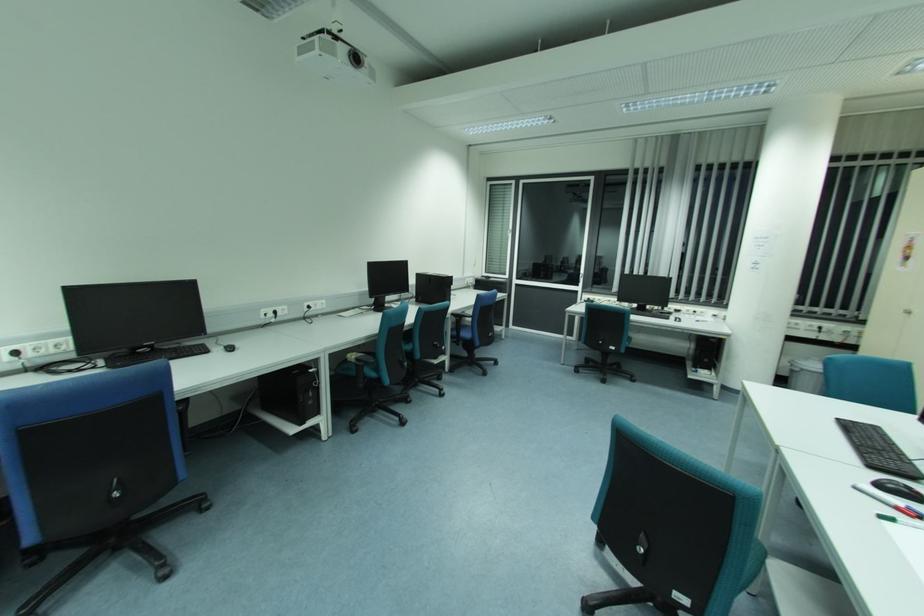
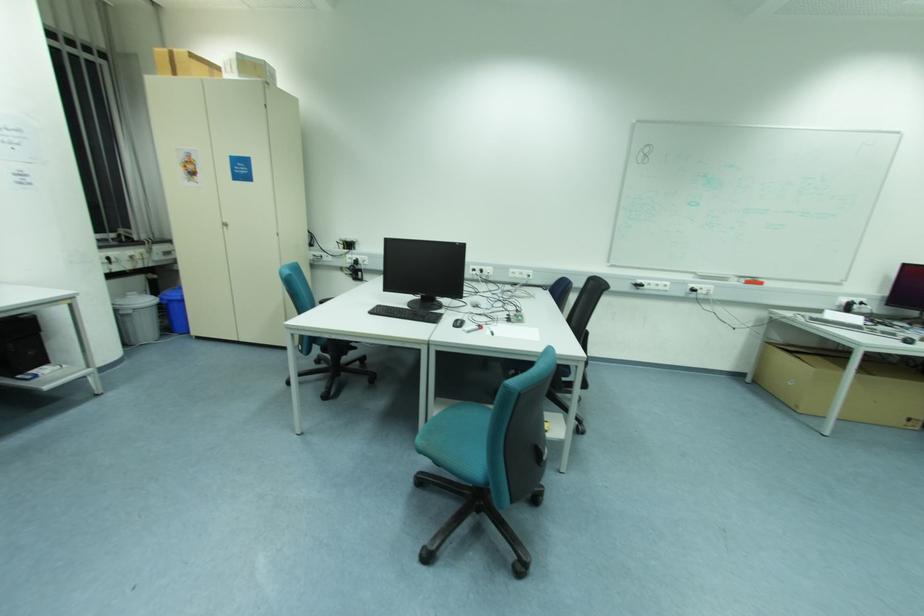
Where in the second image is the point corresponding to [801,365] from the first image?

(130, 305)